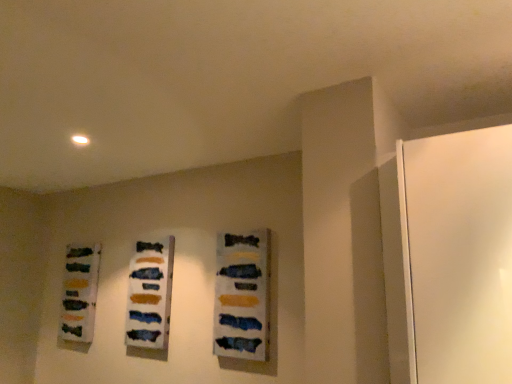
Question: From a real-world perspective, is matte glass bottles at left, the 1th art from the left, above or below matte acrylic painting at center, the 2th art from the right?

Choices:
 (A) above
 (B) below

Answer: (A)

Question: From the image's perspective, is matte glass bottles at left, arranged as the 3th art when viewed from the right, above or below matte acrylic painting at center, which ranks as the second art in left-to-right order?

Choices:
 (A) below
 (B) above

Answer: (A)

Question: Which object is positioned farthest from the matte glass bottles at left, arranged as the 3th art when viewed from the right?

Choices:
 (A) matte acrylic painting at center, which is the first art from front to back
 (B) matte acrylic painting at center, which ranks as the second art in front-to-back order

Answer: (A)

Question: Which of these objects is positioned closest to the matte acrylic painting at center, which appears as the second art when viewed from the back?

Choices:
 (A) matte glass bottles at left, arranged as the 3th art when viewed from the front
 (B) matte acrylic painting at center, which is the first art from front to back

Answer: (B)